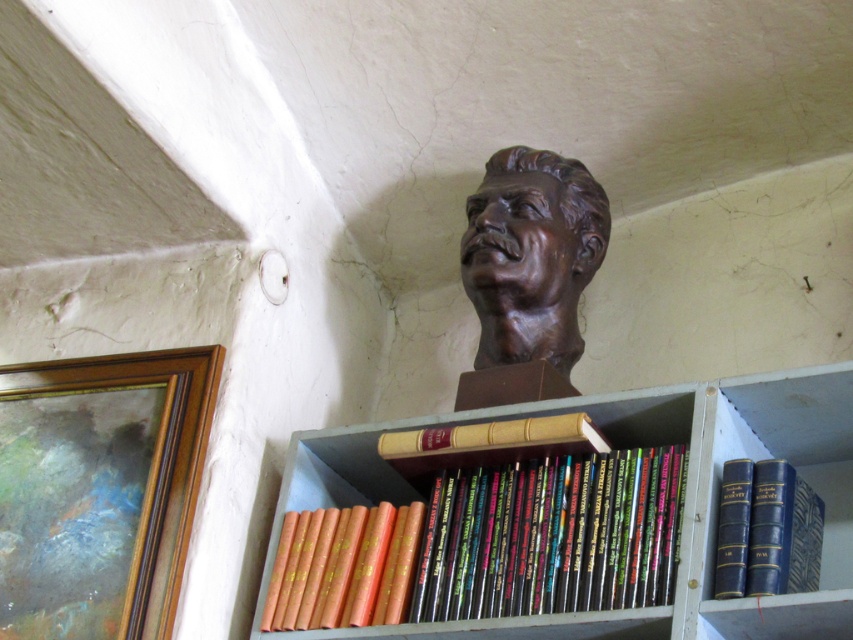
Question: Does bronze bust at upper center have a lesser width compared to gold leather book at center?

Choices:
 (A) yes
 (B) no

Answer: (A)

Question: Considering the real-world distances, which object is closest to the blue leather-bound book at upper right?

Choices:
 (A) gold leather book at center
 (B) wooden bookshelf at upper center
 (C) bronze bust at upper center

Answer: (B)

Question: Which point is closer to the camera?

Choices:
 (A) (426, 456)
 (B) (631, 577)
 (C) (287, 577)

Answer: (B)

Question: Can you confirm if wooden bookshelf at upper center is wider than gold leather book at center?

Choices:
 (A) no
 (B) yes

Answer: (B)

Question: Is blue leather-bound book at upper right wider than gold leather book at center?

Choices:
 (A) no
 (B) yes

Answer: (A)

Question: Which point appears farthest from the camera in this image?

Choices:
 (A) (316, 509)
 (B) (764, 483)
 (C) (593, 422)
 (D) (488, 202)

Answer: (D)